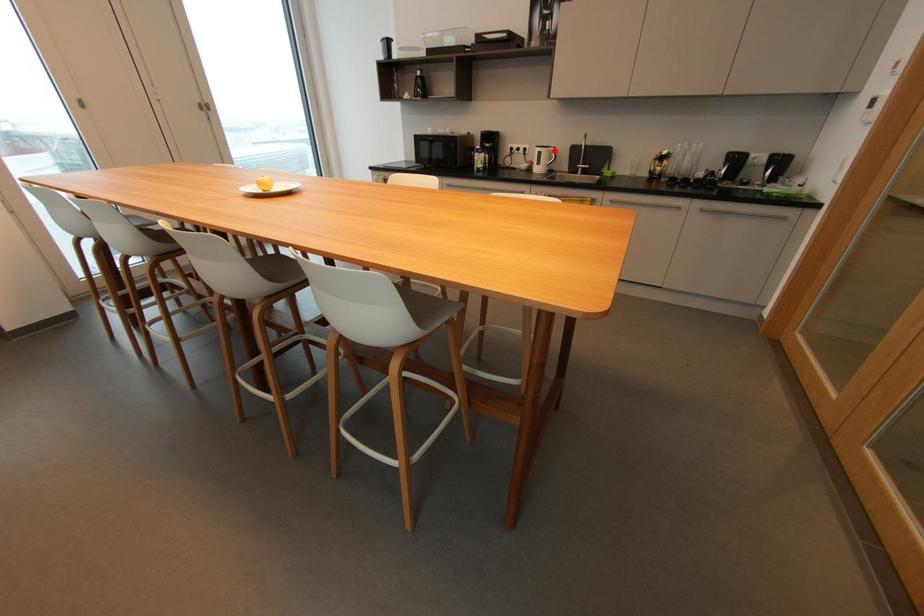
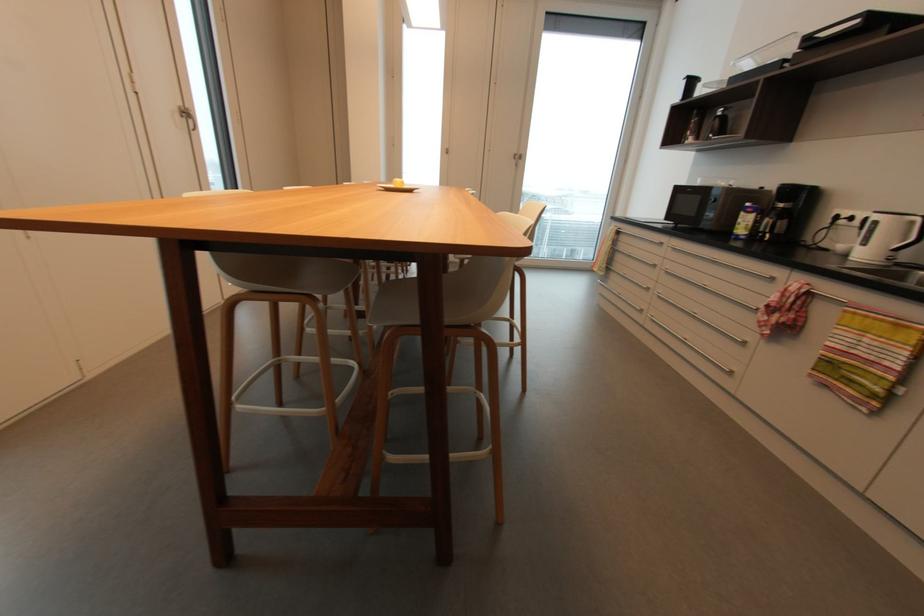
Locate, in the second image, the point that corresponds to the highlighted location in the first image.

(916, 223)